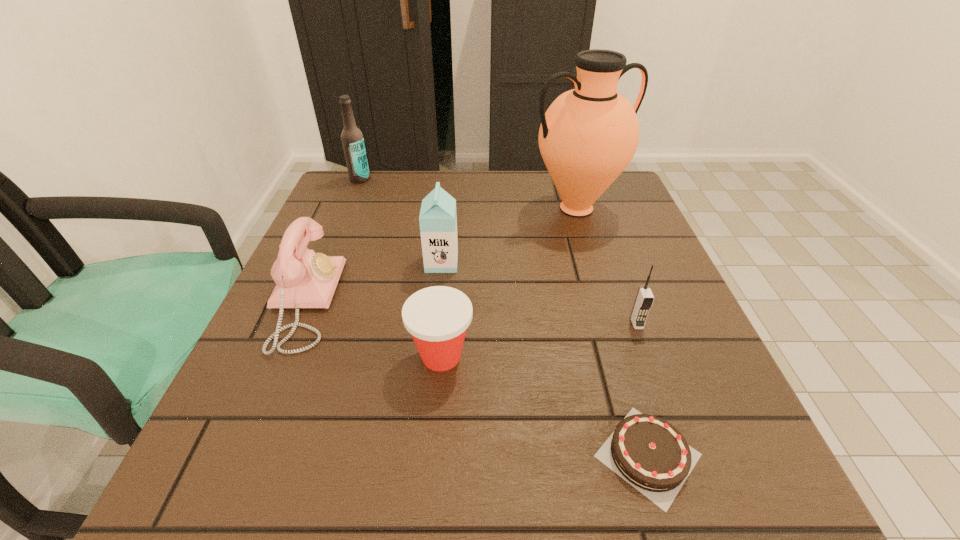
The image size is (960, 540). Identify the location of free spot between the chocolate cake and the Dixie cup. (544, 406).

Locate an element on the screen. free space between the sixth tallest object and the cellular telephone is located at coordinates (539, 340).

Select which object appears as the fifth closest to the fifth shortest object. Please provide its 2D coordinates. Your answer should be formatted as a tuple, i.e. [(x, y)], where the tuple contains the x and y coordinates of a point satisfying the conditions above.

[(352, 139)]

The height and width of the screenshot is (540, 960). Find the location of `object identified as the fourth closest to the farthest object`. object identified as the fourth closest to the farthest object is located at coordinates pyautogui.click(x=437, y=317).

Locate an element on the screen. This screenshot has height=540, width=960. free space that satisfies the following two spatial constraints: 1. on the label of the beer bottle; 2. on the left side of the tallest object is located at coordinates (348, 208).

The height and width of the screenshot is (540, 960). Find the location of `free space that satisfies the following two spatial constraints: 1. on the label of the second tallest object; 2. on the right side of the Dixie cup`. free space that satisfies the following two spatial constraints: 1. on the label of the second tallest object; 2. on the right side of the Dixie cup is located at coordinates (286, 356).